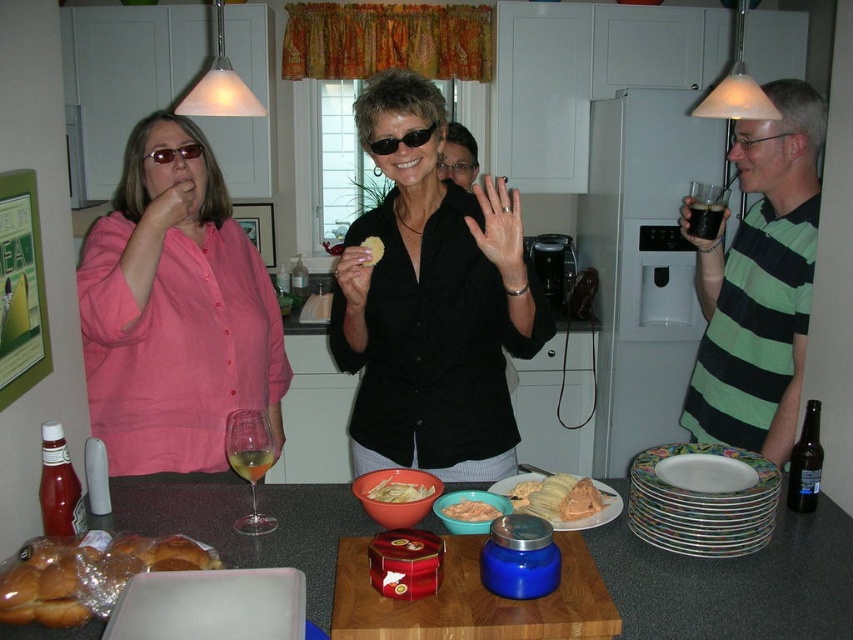
You are a delivery person who needs to place a package between the translucent plastic bread at lower left and the black plastic goggles at center. The package is 2 meters long. Will it fit between them?

The distance between the translucent plastic bread at lower left and the black plastic goggles at center is 1.95 meters. Since the package is 2 meters long, it will not fit between them as the space is slightly shorter than the package.

You are a guest at this gathering and want to grab the black plastic goggles at center without touching the translucent plastic bread at lower left. Is this possible?

Yes, since the translucent plastic bread at lower left is to the left of the black plastic goggles at center, you can reach the black plastic goggles at center by moving your hand to the right side of the translucent plastic bread at lower left.

You are a food critic attending a tasting event and see the golden corn tamale at center and the yellow crispy chips at center on the table. Which of these two items is taller?

The golden corn tamale at center is taller than the yellow crispy chips at center.